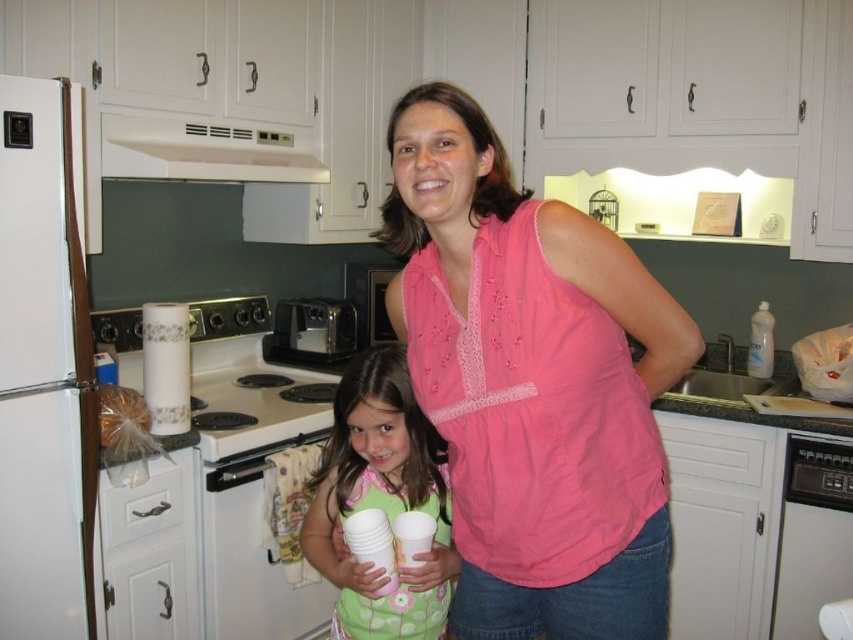
Question: Which of the following is the farthest from the observer?

Choices:
 (A) metallic silver toaster at center
 (B) white matte exhaust hood at upper center
 (C) black plastic dishwasher at lower right

Answer: (A)

Question: Which of the following is the closest to the observer?

Choices:
 (A) metallic silver toaster at center
 (B) white matte exhaust hood at upper center
 (C) white glossy stove at lower left

Answer: (C)

Question: Considering the real-world distances, which object is farthest from the black metallic toaster at center?

Choices:
 (A) green polka dot dress at center
 (B) clear plastic bottle at right
 (C) white matte refrigerator at left
 (D) black plastic dishwasher at lower right

Answer: (D)

Question: Is pink cotton shirt at center wider than clear plastic bottle at right?

Choices:
 (A) yes
 (B) no

Answer: (A)

Question: Can you confirm if metallic silver toaster at center is positioned above clear plastic bottle at right?

Choices:
 (A) yes
 (B) no

Answer: (A)

Question: Is white matte exhaust hood at upper center thinner than clear plastic bottle at right?

Choices:
 (A) no
 (B) yes

Answer: (A)